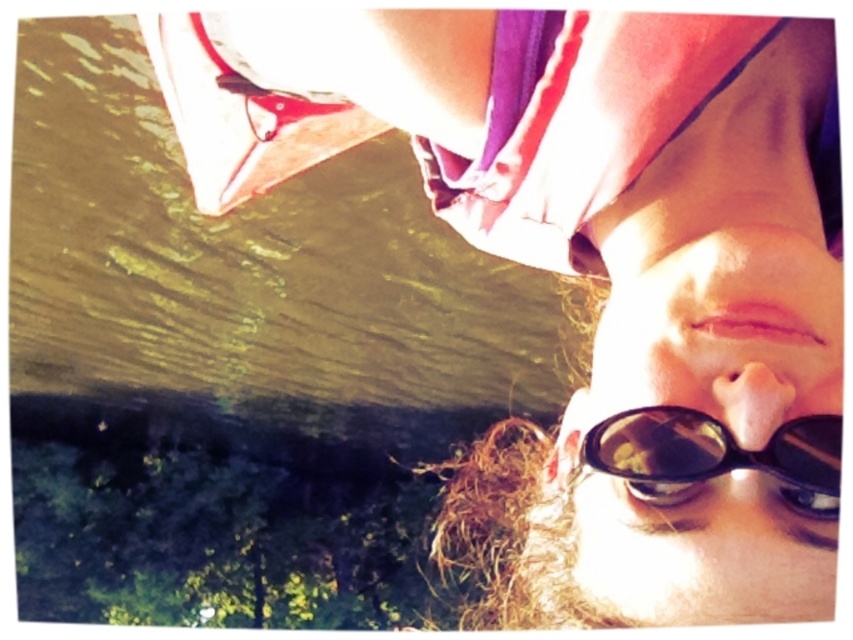
Does purple silky headscarf at upper center have a smaller size compared to black matte sunglasses at lower center?

No.

Is point (637, 38) farther from camera compared to point (642, 477)?

No.

Find the location of `purple silky headscarf at upper center`. purple silky headscarf at upper center is located at coordinates (578, 122).